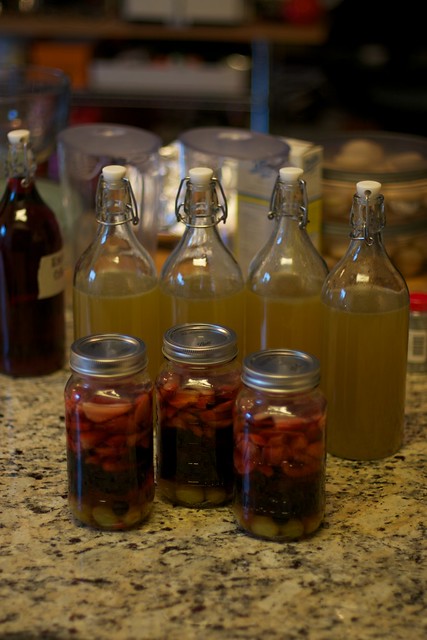
The image size is (427, 640). Identify the location of bottle. (359, 271).